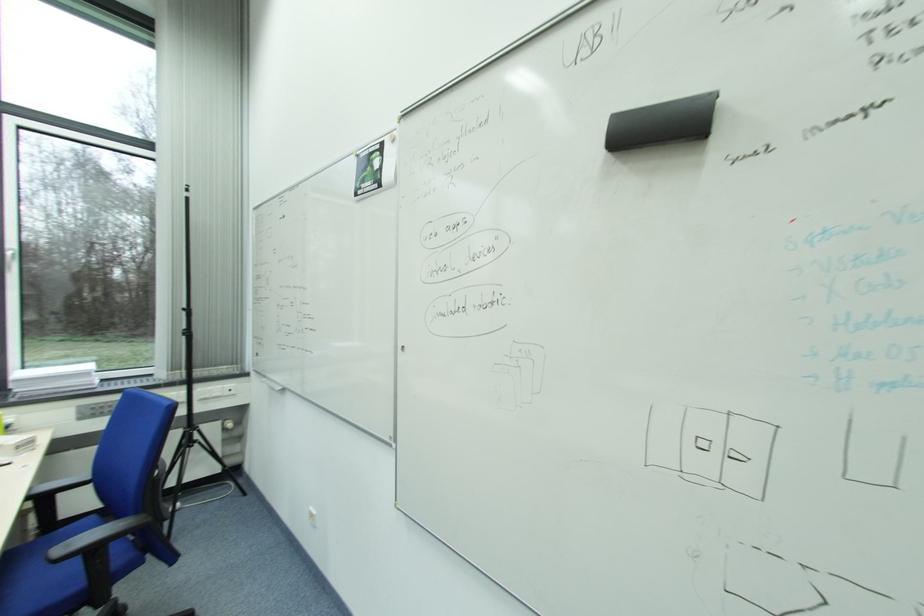
This screenshot has height=616, width=924. I want to click on stand adjustment knob, so click(x=661, y=123).